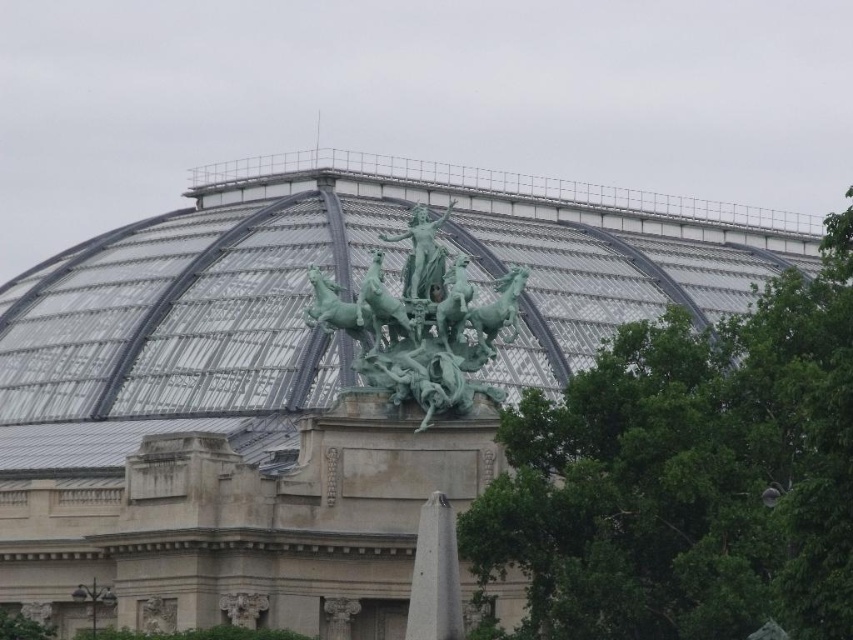
Question: Among these objects, which one is nearest to the camera?

Choices:
 (A) green leafy tree at upper right
 (B) green polished stone statue at center

Answer: (A)

Question: Can you confirm if green patina statue at center is positioned below green polished stone statue at center?

Choices:
 (A) yes
 (B) no

Answer: (A)

Question: Is green patina statue at center above green polished stone statue at center?

Choices:
 (A) yes
 (B) no

Answer: (B)

Question: Estimate the real-world distances between objects in this image. Which object is farther from the green leafy tree at upper right?

Choices:
 (A) green patina statue at center
 (B) green polished stone statue at center

Answer: (B)

Question: Does green leafy tree at upper right appear on the left side of green patina statue at center?

Choices:
 (A) no
 (B) yes

Answer: (A)

Question: Which point is farther to the camera?

Choices:
 (A) (392, 236)
 (B) (361, 372)

Answer: (A)